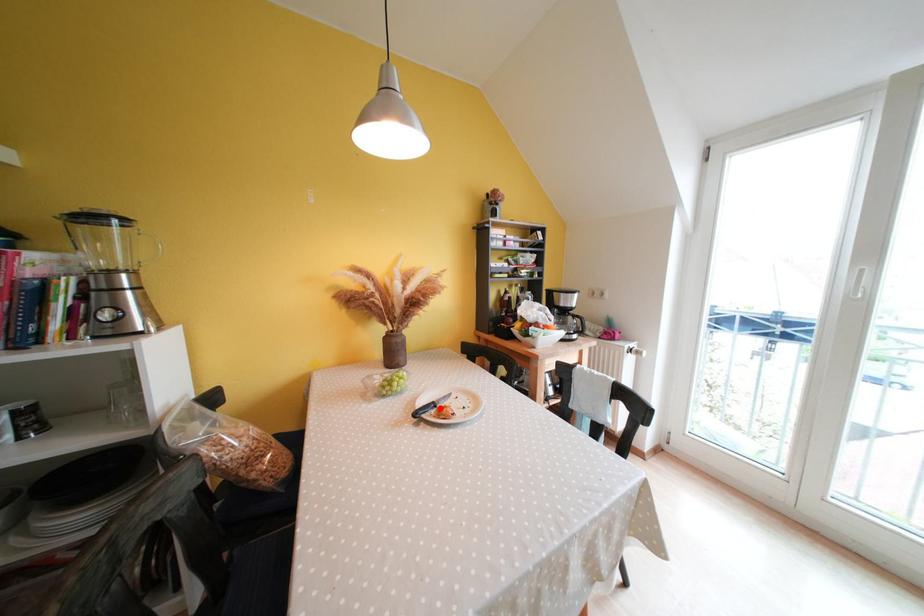
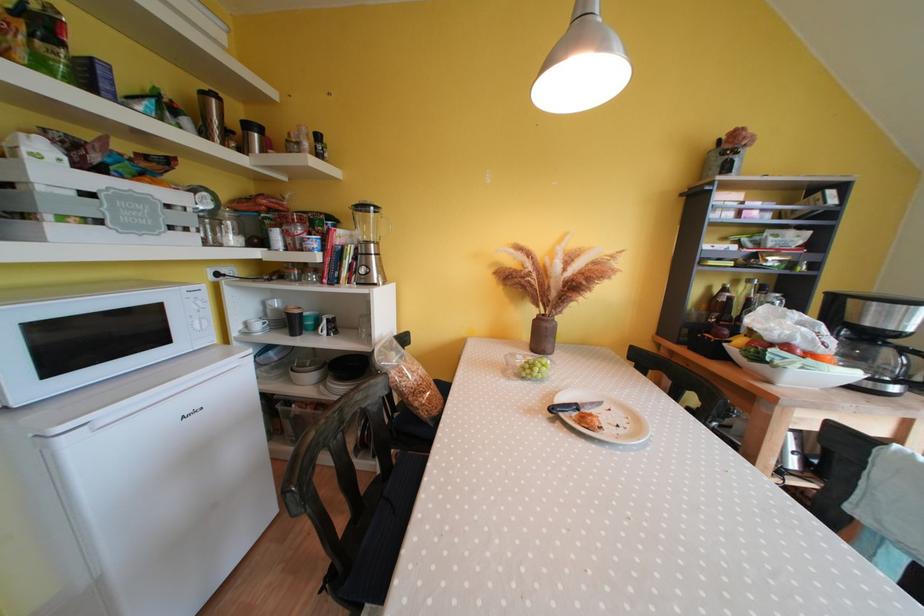
In the second image, find the point that corresponds to the highlighted location in the first image.

(582, 410)